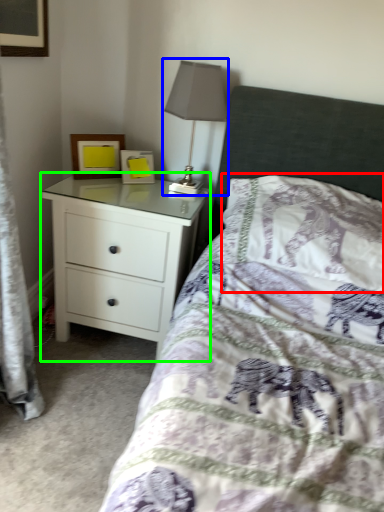
Question: Considering the real-world distances, which object is farthest from pillow (highlighted by a red box)? table lamp (highlighted by a blue box) or chest of drawers (highlighted by a green box)?

Choices:
 (A) table lamp
 (B) chest of drawers

Answer: (B)